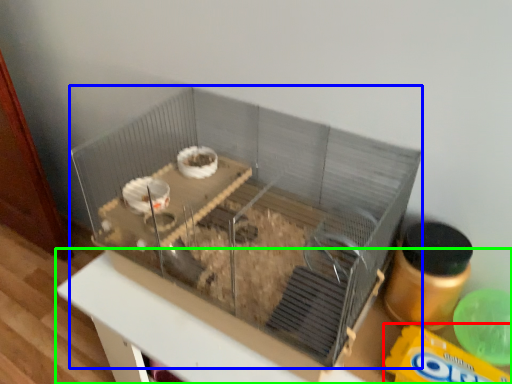
Question: Which is nearer to the cereal (highlighted by a red box)? glass box (highlighted by a blue box) or table (highlighted by a green box).

Choices:
 (A) glass box
 (B) table

Answer: (B)